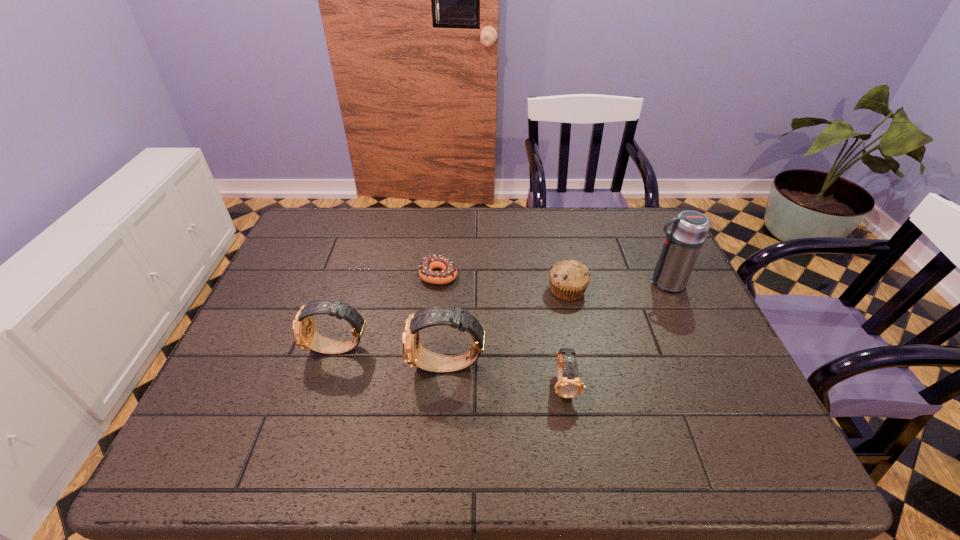
This screenshot has height=540, width=960. I want to click on the fourth shortest object, so click(305, 335).

Where is `the leftmost watch`? The image size is (960, 540). the leftmost watch is located at coordinates (305, 335).

Identify the location of the second watch from left to right. The height and width of the screenshot is (540, 960). (414, 354).

Locate an element on the screen. the rightmost watch is located at coordinates (569, 385).

Locate an element on the screen. the tallest object is located at coordinates point(682,245).

You are a GUI agent. You are given a task and a screenshot of the screen. Output one action in this format:
    pyautogui.click(x=<x>, y=<y>)
    Task: Click on the rightmost object
    
    Given the screenshot: What is the action you would take?
    pyautogui.click(x=682, y=245)

Find the location of a particular element. The image size is (960, 540). doughnut is located at coordinates (449, 273).

Find the location of a particular element. muffin is located at coordinates (568, 280).

What are the coordinates of `free space located 0.060m on the face of the leftmost object` in the screenshot? It's located at (282, 349).

Identify the location of vacant area located on the face of the leftmost object. (270, 349).